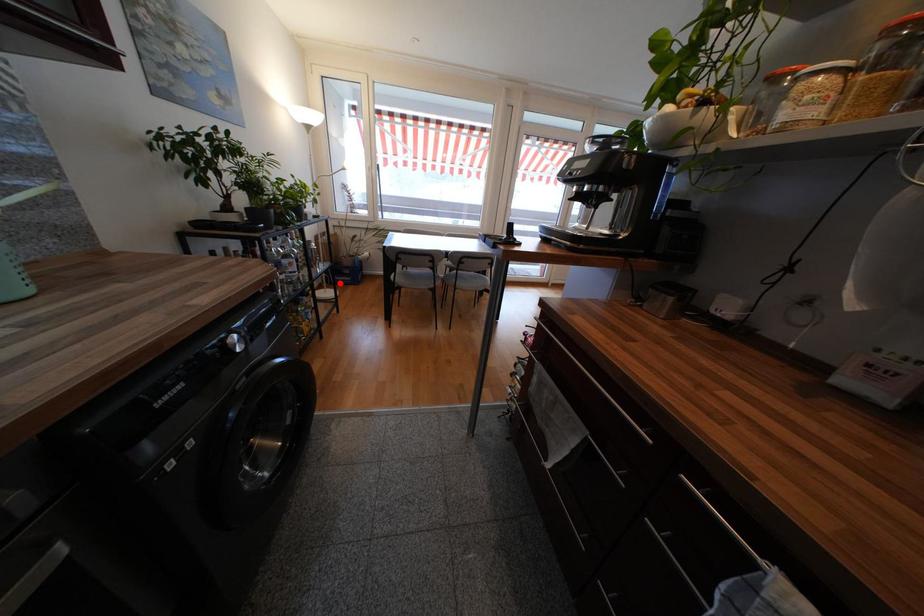
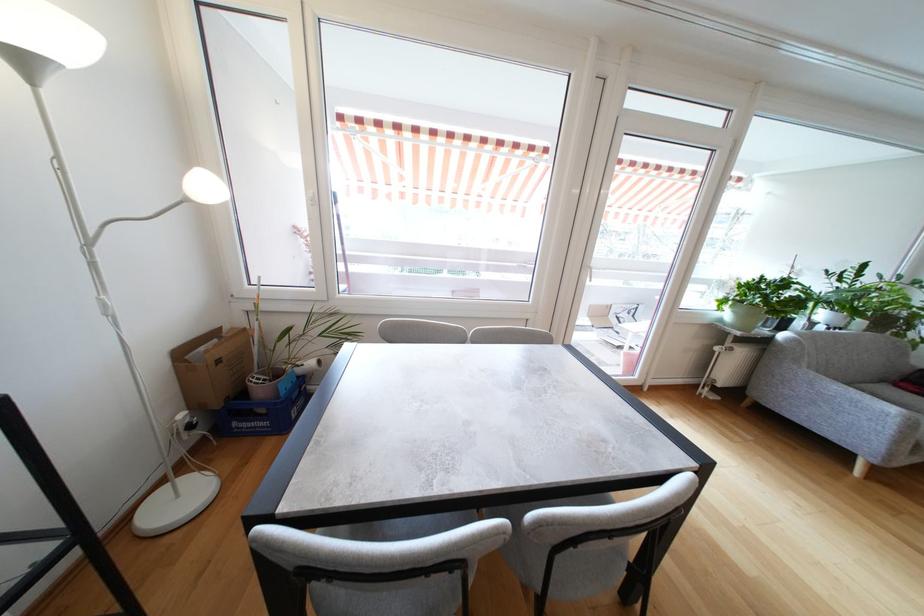
Question: I am providing you with two images of the same scene from different viewpoints. Image1 has a red point marked. In image2, the corresponding 3D location appears at what relative position? Reply with the corresponding letter.

Choices:
 (A) Closer
 (B) Farther

Answer: (B)